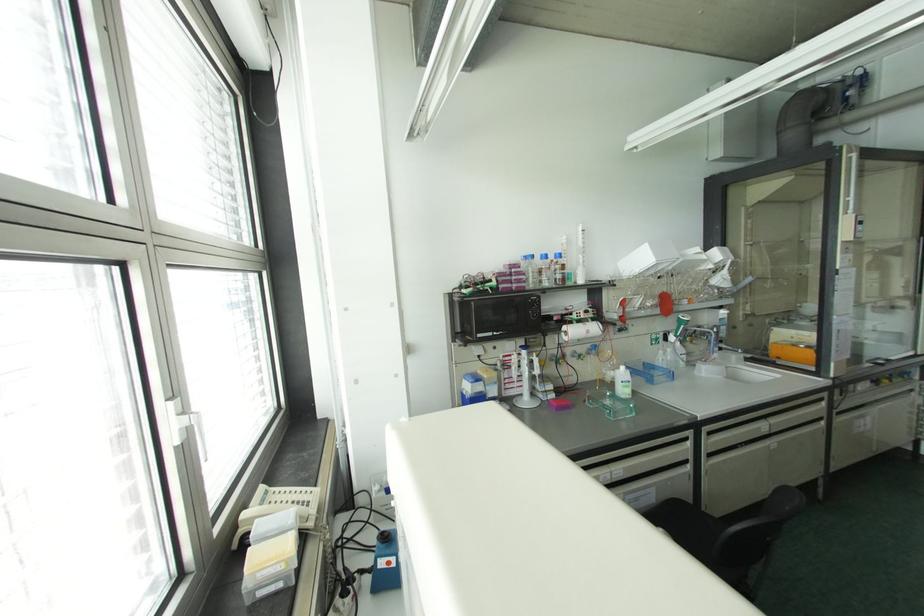
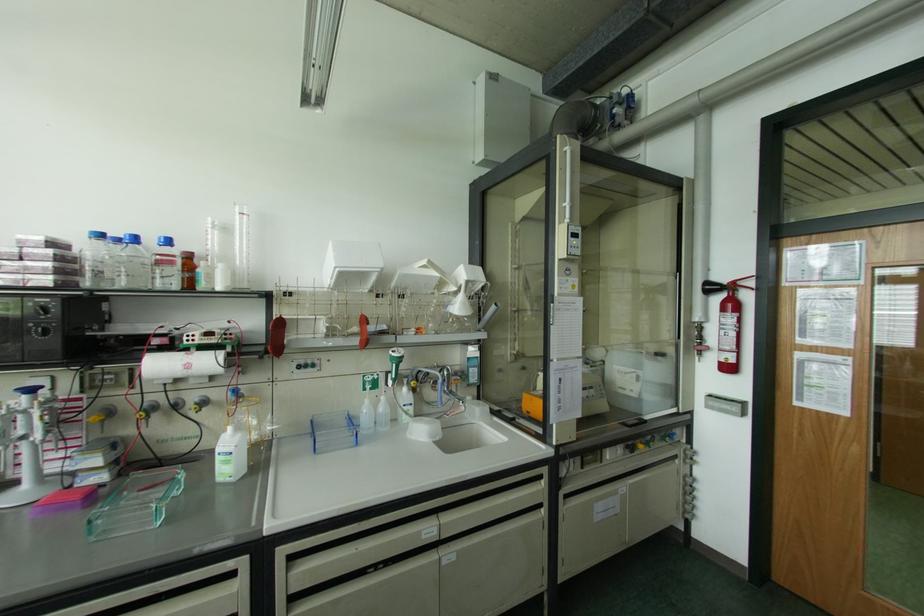
In the second image, find the point that corresponds to (544,256) in the first image.

(134, 238)